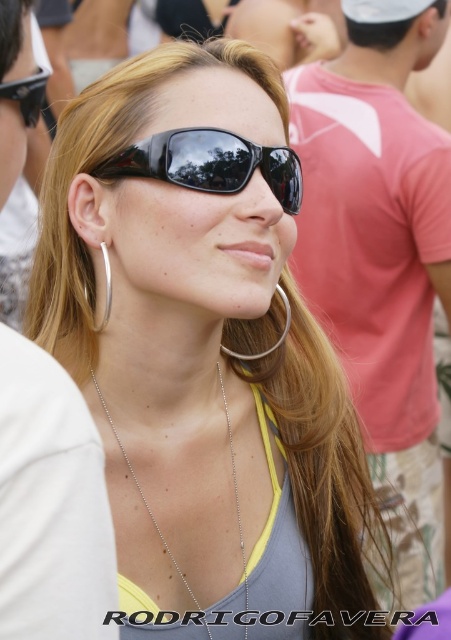
Question: Which object is farther from the camera taking this photo?

Choices:
 (A) silver metallic hoop at left
 (B) black plastic sunglasses at center
 (C) silver metallic hoop at center
 (D) silver chain necklace at center

Answer: (C)

Question: Does black plastic sunglasses at upper center appear under silver metallic hoop at left?

Choices:
 (A) no
 (B) yes

Answer: (A)

Question: Considering the real-world distances, which object is closest to the silver metallic hoop at left?

Choices:
 (A) black plastic sunglasses at upper center
 (B) black plastic sunglasses at center
 (C) silver chain necklace at center

Answer: (B)

Question: Is the position of silver chain necklace at center less distant than that of silver metallic hoop at left?

Choices:
 (A) no
 (B) yes

Answer: (B)

Question: Which point is closer to the camera?

Choices:
 (A) (107, 294)
 (B) (276, 346)
 (C) (169, 140)

Answer: (C)

Question: Does silver chain necklace at center come in front of black plastic sunglasses at upper center?

Choices:
 (A) yes
 (B) no

Answer: (B)